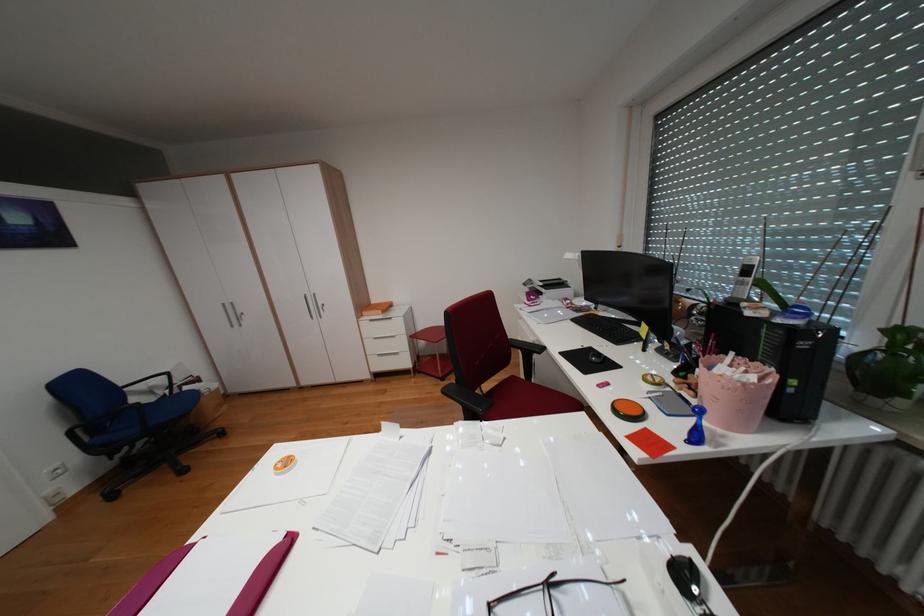
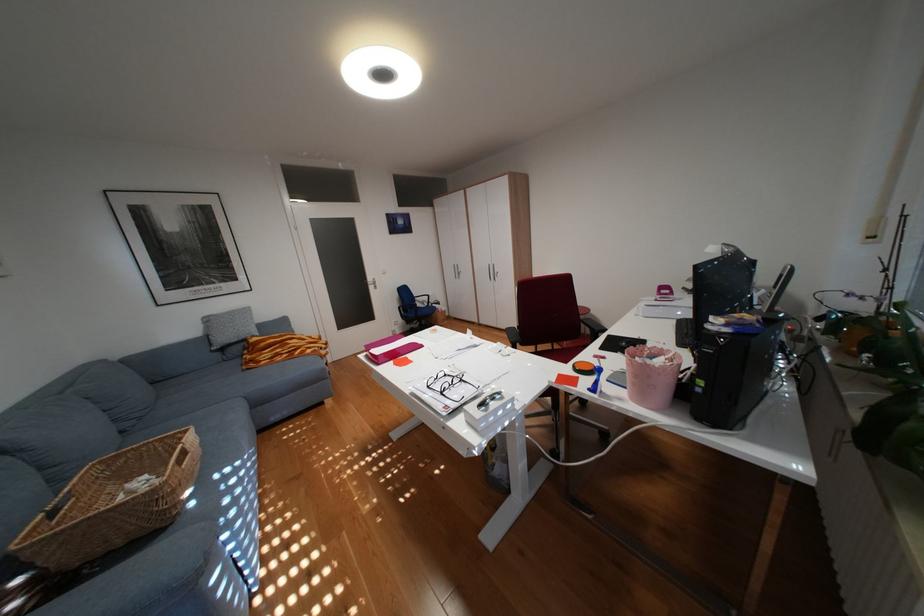
The point at [735,436] is marked in the first image. Where is the corresponding point in the second image?

(633, 399)